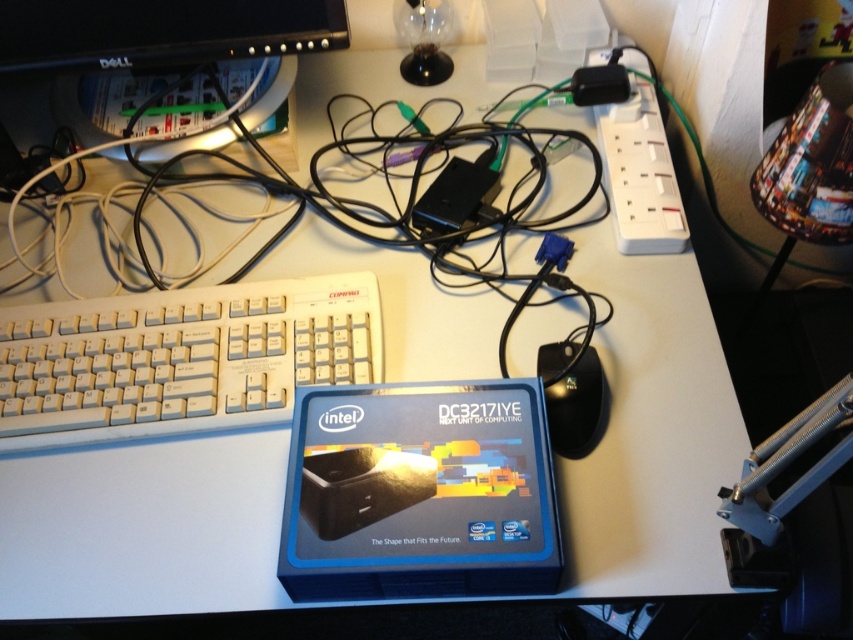
Question: Is white plastic keyboard at left closer to camera compared to black plastic plug at upper right?

Choices:
 (A) yes
 (B) no

Answer: (A)

Question: Can you confirm if blue matte intel dc3217iye at center is bigger than black plastic mouse at lower right?

Choices:
 (A) yes
 (B) no

Answer: (A)

Question: Which point is closer to the camera taking this photo?

Choices:
 (A) (248, 54)
 (B) (323, 522)

Answer: (B)

Question: Can you confirm if blue matte intel dc3217iye at center is thinner than black plastic mouse at lower right?

Choices:
 (A) yes
 (B) no

Answer: (B)

Question: Which point is farther from the camera taking this photo?

Choices:
 (A) (529, 554)
 (B) (231, 378)
 (C) (674, 212)
 (D) (173, 10)

Answer: (C)

Question: Which object is the closest to the black plastic plug at upper right?

Choices:
 (A) black plastic monitor at upper left
 (B) black plastic mouse at lower right

Answer: (B)